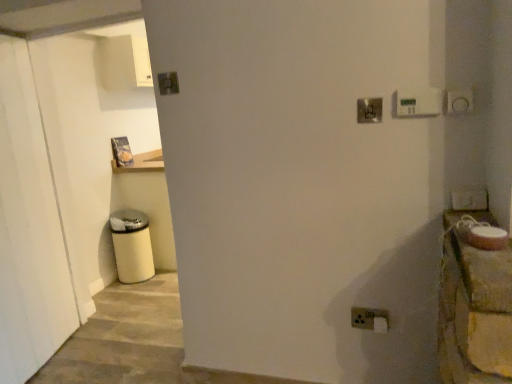
Question: Is metallic silver switch at upper right, arranged as the third light switch when viewed from the front, facing away from white plastic thermostat at upper right, which is the first light switch from front to back?

Choices:
 (A) yes
 (B) no

Answer: (B)

Question: From the image's perspective, is metallic silver switch at upper right, which ranks as the 2th light switch in back-to-front order, located beneath white plastic thermostat at upper right, which is the third light switch in bottom-to-top order?

Choices:
 (A) no
 (B) yes

Answer: (B)

Question: From the image's perspective, is metallic silver switch at upper right, which ranks as the 3th light switch in top-to-bottom order, over white plastic thermostat at upper right, which is counted as the 3th light switch, starting from the left?

Choices:
 (A) no
 (B) yes

Answer: (A)

Question: Is metallic silver switch at upper right, placed as the third light switch when sorted from right to left, further to the viewer compared to white plastic thermostat at upper right, the 4th light switch in the back-to-front sequence?

Choices:
 (A) yes
 (B) no

Answer: (A)

Question: Is metallic silver switch at upper right, which ranks as the 2th light switch in left-to-right order, closer to the viewer compared to white plastic thermostat at upper right, the second light switch when ordered from top to bottom?

Choices:
 (A) no
 (B) yes

Answer: (A)

Question: From the image's perspective, relative to white plastic light switch at upper right, the 4th light switch viewed from the top, is metallic silver switch at upper right, placed as the third light switch when sorted from right to left, above or below?

Choices:
 (A) below
 (B) above

Answer: (B)

Question: Relative to white plastic light switch at upper right, the 4th light switch viewed from the top, is metallic silver switch at upper right, marked as the second light switch in a bottom-to-top arrangement, in front or behind?

Choices:
 (A) front
 (B) behind

Answer: (B)

Question: From a real-world perspective, relative to white plastic light switch at upper right, marked as the third light switch in a back-to-front arrangement, is metallic silver switch at upper right, which ranks as the 3th light switch in top-to-bottom order, vertically above or below?

Choices:
 (A) above
 (B) below

Answer: (A)

Question: Considering the positions of point (362, 112) and point (482, 200), is point (362, 112) closer or farther from the camera than point (482, 200)?

Choices:
 (A) farther
 (B) closer

Answer: (A)

Question: Does point (380, 110) appear closer or farther from the camera than point (483, 271)?

Choices:
 (A) farther
 (B) closer

Answer: (A)

Question: In the image, is metallic silver switch at upper right, placed as the third light switch when sorted from right to left, positioned in front of or behind rustic wood countertop at right?

Choices:
 (A) front
 (B) behind

Answer: (B)

Question: Is metallic silver switch at upper right, marked as the second light switch in a bottom-to-top arrangement, wider or thinner than rustic wood countertop at right?

Choices:
 (A) wide
 (B) thin

Answer: (B)

Question: Considering the positions of metallic silver switch at upper right, arranged as the third light switch when viewed from the front, and rustic wood countertop at right in the image, is metallic silver switch at upper right, arranged as the third light switch when viewed from the front, bigger or smaller than rustic wood countertop at right?

Choices:
 (A) big
 (B) small

Answer: (B)

Question: From their relative heights in the image, would you say white plastic electric outlet at lower right is taller or shorter than metallic silver switch at upper right, which ranks as the 3th light switch in top-to-bottom order?

Choices:
 (A) tall
 (B) short

Answer: (A)

Question: In the image, is white plastic electric outlet at lower right positioned in front of or behind metallic silver switch at upper right, arranged as the third light switch when viewed from the front?

Choices:
 (A) behind
 (B) front

Answer: (A)